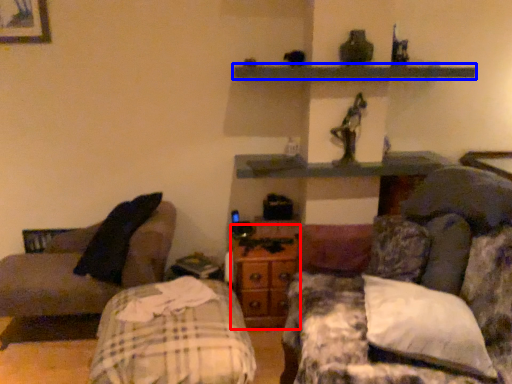
Question: Which point is further to the camera, dresser (highlighted by a red box) or shelf (highlighted by a blue box)?

Choices:
 (A) dresser
 (B) shelf

Answer: (A)